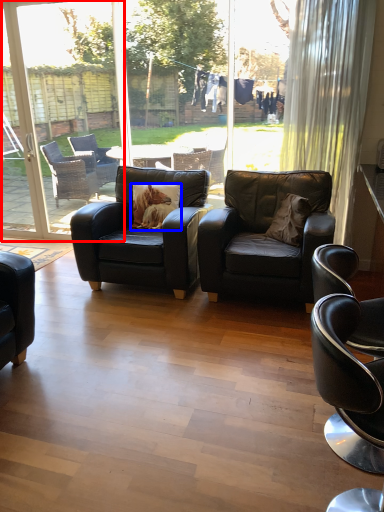
Question: Which point is closer to the camera, screen door (highlighted by a red box) or pillow (highlighted by a blue box)?

Choices:
 (A) screen door
 (B) pillow

Answer: (B)